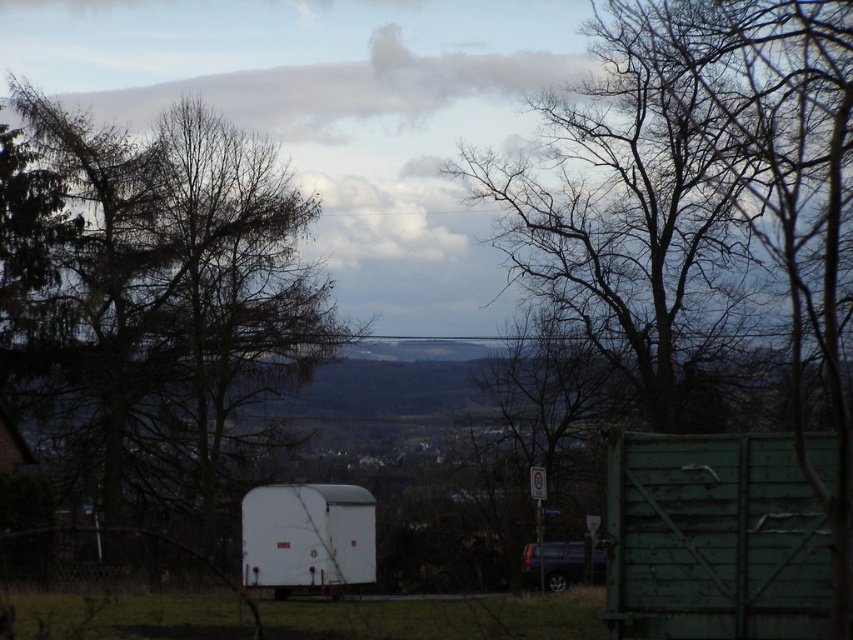
Between point (108, 316) and point (314, 554), which one is positioned behind?

The point (108, 316) is behind.

Who is more distant from viewer, [187,269] or [363,532]?

The point [187,269] is more distant.

Where is `dark brown bark tree at left`? dark brown bark tree at left is located at coordinates (161, 308).